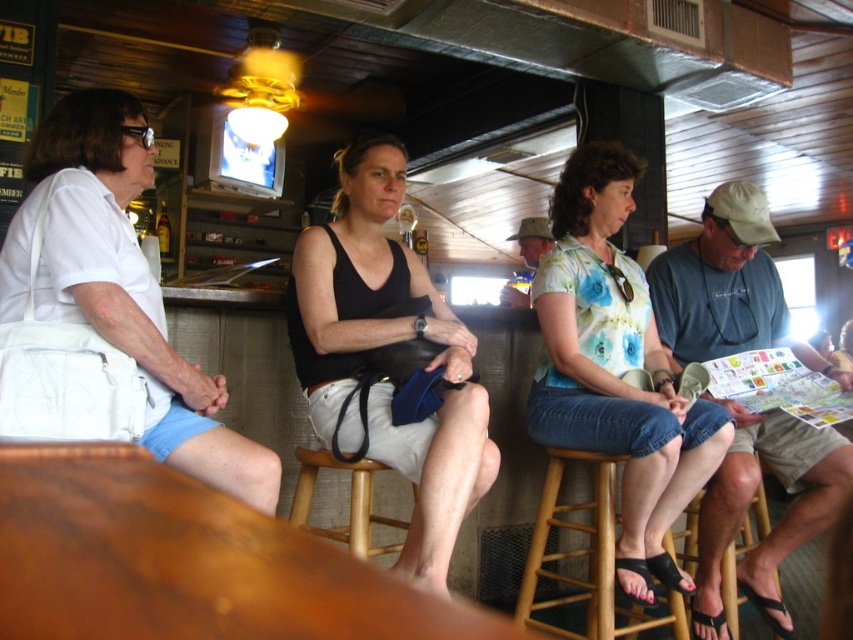
You are trying to place a small phone charger on the table near the white fabric purse at left and the wooden bar stool at lower right. Which object requires more space on the table?

The wooden bar stool at lower right requires more space on the table because it occupies more space than the white fabric purse at left.

You are a delivery person holding a package that requires placing between the white fabric purse at left and the wooden bar stool at lower right. The package is 1.5 meters long. Will it fit in the space between them?

The distance between the white fabric purse at left and the wooden bar stool at lower right is 1.65 meters. Since the package is 1.5 meters long, it will fit with some space to spare.

You are standing at the bar and want to place a small decorative item between the blue denim shorts at right and the wooden bar stool at lower right. Which object should you place it closer to if you want it to be near the smaller object?

The wooden bar stool at lower right is smaller than the blue denim shorts at right, so placing the item closer to the wooden bar stool at lower right would be near the smaller object.